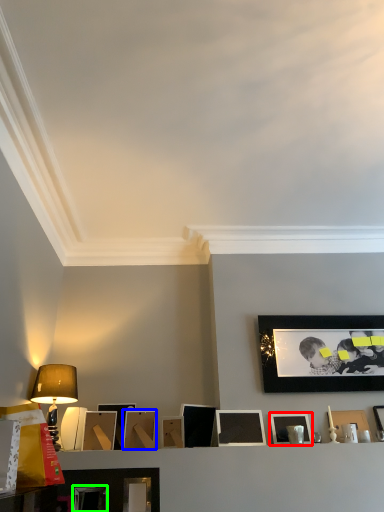
Question: Which is nearer to the picture frame (highlighted by a red box)? picture frame (highlighted by a blue box) or picture frame (highlighted by a green box).

Choices:
 (A) picture frame
 (B) picture frame

Answer: (A)